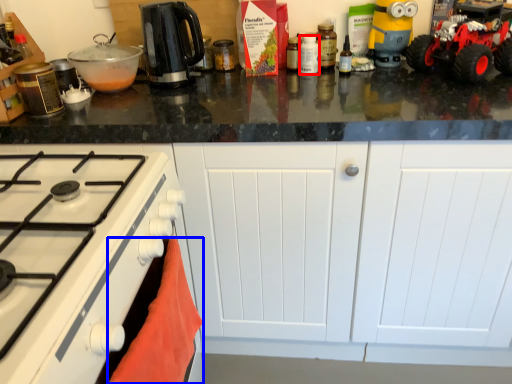
Question: Which object appears closest to the camera in this image, kitchen appliance (highlighted by a red box) or material (highlighted by a blue box)?

Choices:
 (A) kitchen appliance
 (B) material

Answer: (B)